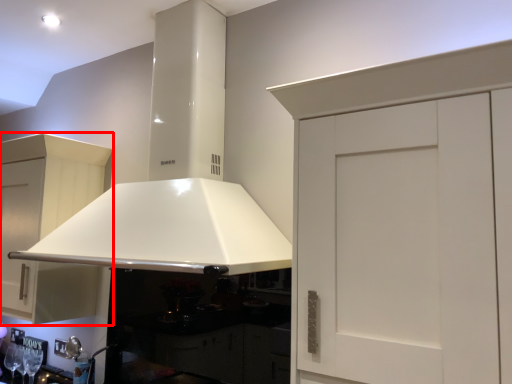
Question: Observing the image, what is the correct spatial positioning of cabinetry (annotated by the red box) in reference to exhaust hood?

Choices:
 (A) left
 (B) right

Answer: (A)